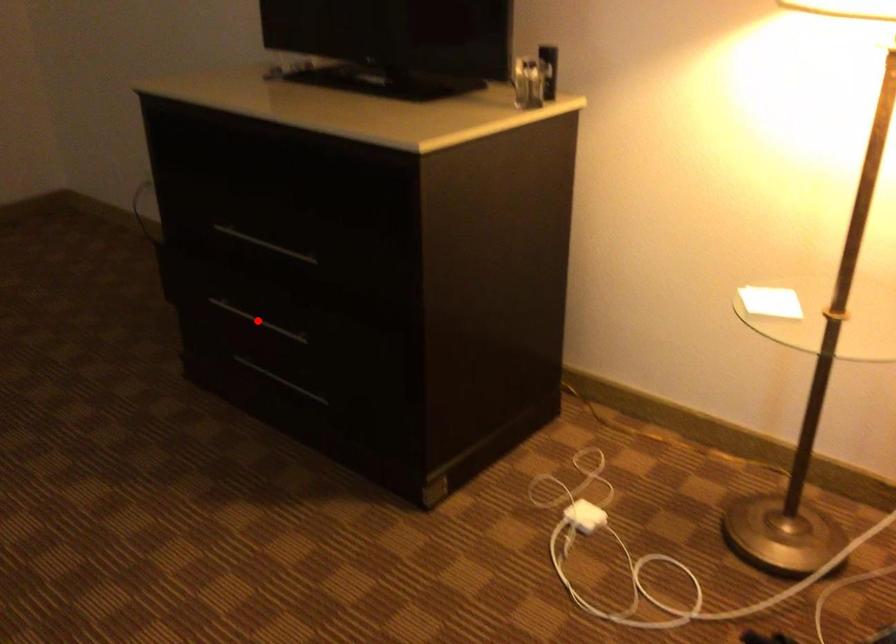
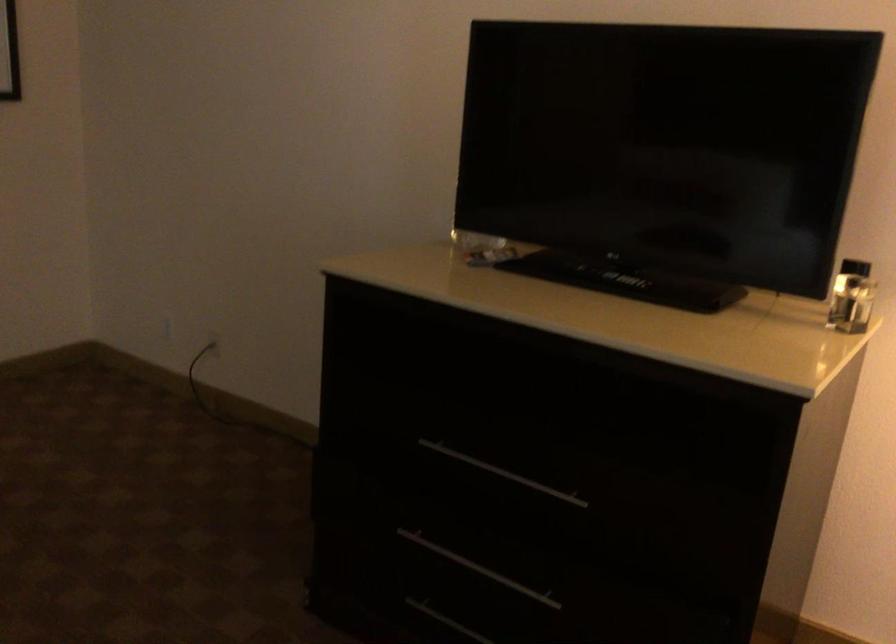
Question: A red point is marked in image1. In image2, is the corresponding 3D point closer to the camera or farther? Reply with the corresponding letter.

Choices:
 (A) The corresponding 3D point is closer.
 (B) The corresponding 3D point is farther.

Answer: (A)